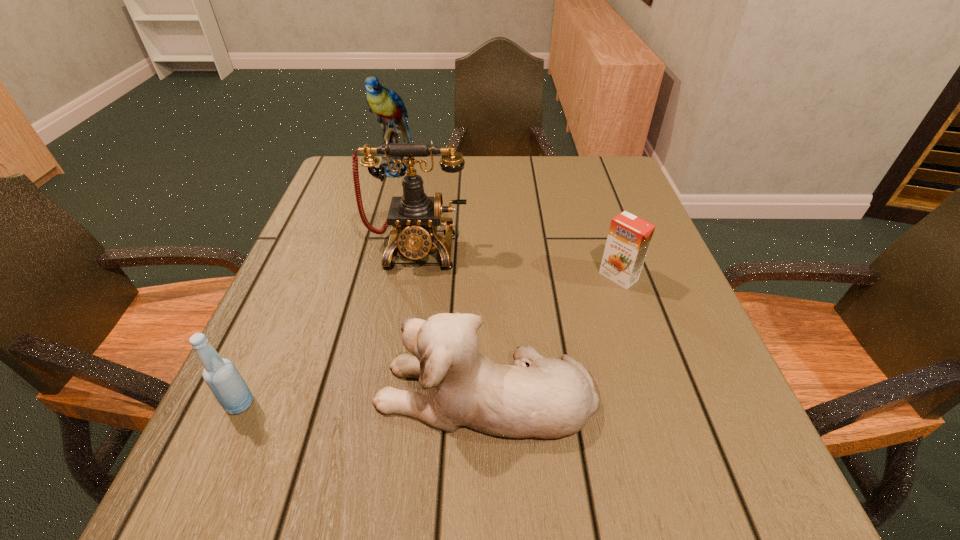
In the image, there is a desktop. Identify the location of vacant region at the near edge. The width and height of the screenshot is (960, 540). (439, 467).

In the image, there is a desktop. At what (x,y) coordinates should I click in order to perform the action: click on vacant space at the left edge. Please return your answer as a coordinate pair (x, y). This screenshot has height=540, width=960. Looking at the image, I should click on (329, 353).

This screenshot has width=960, height=540. In the image, there is a desktop. What are the coordinates of `vacant space at the right edge` in the screenshot? It's located at (593, 256).

In the image, there is a desktop. At what (x,y) coordinates should I click in order to perform the action: click on vacant space at the far left corner. Please return your answer as a coordinate pair (x, y). The image size is (960, 540). Looking at the image, I should click on (371, 185).

Find the location of a particular element. This screenshot has width=960, height=540. empty space that is in between the farthest object and the puppy is located at coordinates (440, 281).

The height and width of the screenshot is (540, 960). What are the coordinates of `unoccupied position between the puppy and the shortest object` in the screenshot? It's located at (552, 335).

Find the location of a particular element. vacant space that is in between the farthest object and the orange juice is located at coordinates (507, 223).

At what (x,y) coordinates should I click in order to perform the action: click on vacant space that is in between the rightmost object and the farthest object. Please return your answer as a coordinate pair (x, y). The height and width of the screenshot is (540, 960). Looking at the image, I should click on (507, 223).

Identify the location of vacant area that lies between the rightmost object and the telephone. The height and width of the screenshot is (540, 960). (517, 262).

Locate an element on the screen. The width and height of the screenshot is (960, 540). free space that is in between the orange juice and the parrot is located at coordinates (507, 223).